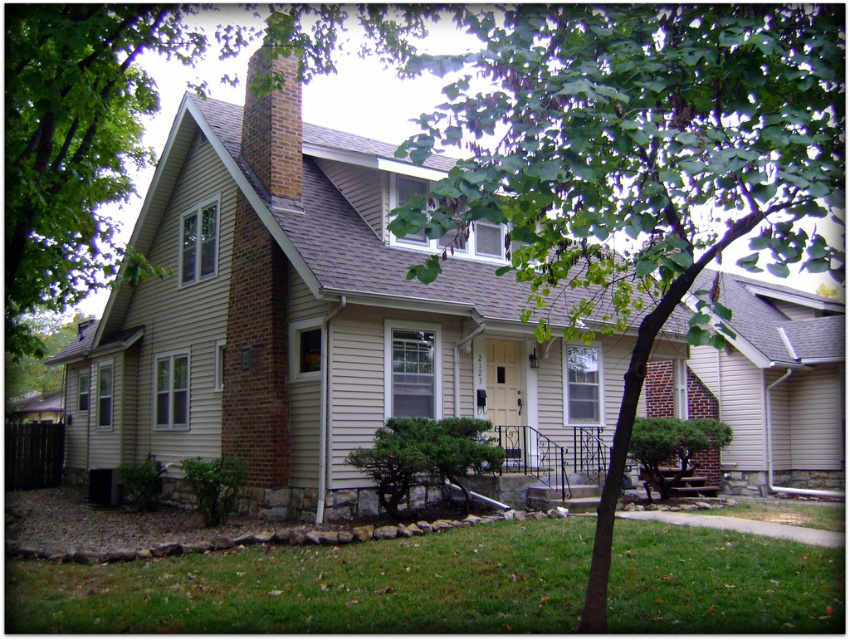
You are standing at the front door of the house and want to water the green leafy tree at center. Based on its position, which direction should you walk to reach the tree?

The green leafy tree at center is located at point coordinates, so you should walk towards the center of the front yard to reach it.

You are standing in the front yard of the house. There is a point marked at coordinates (636, 163). What object does this point correspond to?

The point at coordinates (636, 163) corresponds to the green leafy tree at center.

You are standing at the front door of the house and want to walk to the green grass at lower left. Which direction should you face to see the green leafy tree at center behind you?

If you face the green grass at lower left from the front door, the green leafy tree at center will be behind you to your right side since it is to the right of the green grass at lower left.